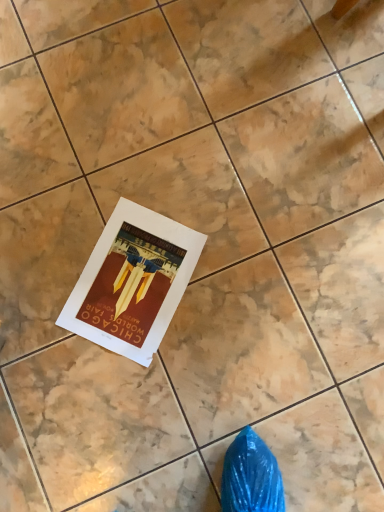
The height and width of the screenshot is (512, 384). I want to click on vacant space behind matte paper poster at center, so click(141, 170).